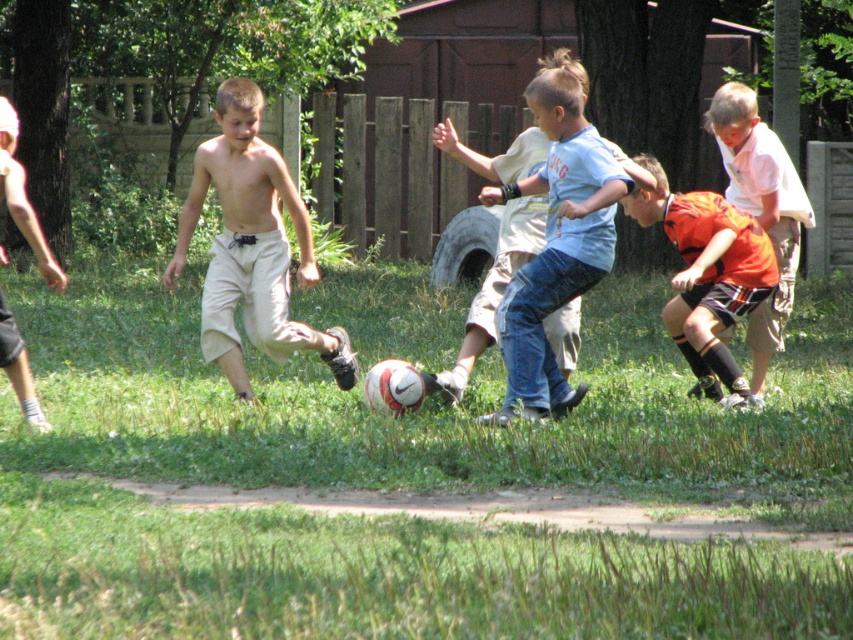
Question: Does blue denim jeans at center have a lesser width compared to orange jersey shorts at lower right?

Choices:
 (A) yes
 (B) no

Answer: (A)

Question: Among these points, which one is nearest to the camera?

Choices:
 (A) (753, 332)
 (B) (251, 340)
 (C) (666, 211)

Answer: (B)

Question: Which point is closer to the camera?

Choices:
 (A) (427, 364)
 (B) (613, 172)
 (C) (788, 300)
 (D) (276, 339)

Answer: (B)

Question: Can you confirm if beige cotton shorts at center is positioned above blue denim jeans at center?

Choices:
 (A) yes
 (B) no

Answer: (B)

Question: Which point appears closest to the camera in this image?

Choices:
 (A) (202, 524)
 (B) (764, 227)
 (C) (25, 387)
 (D) (184, 211)

Answer: (A)

Question: Considering the relative positions of beige cotton shorts at center and blue denim jeans at center in the image provided, where is beige cotton shorts at center located with respect to blue denim jeans at center?

Choices:
 (A) above
 (B) below

Answer: (B)